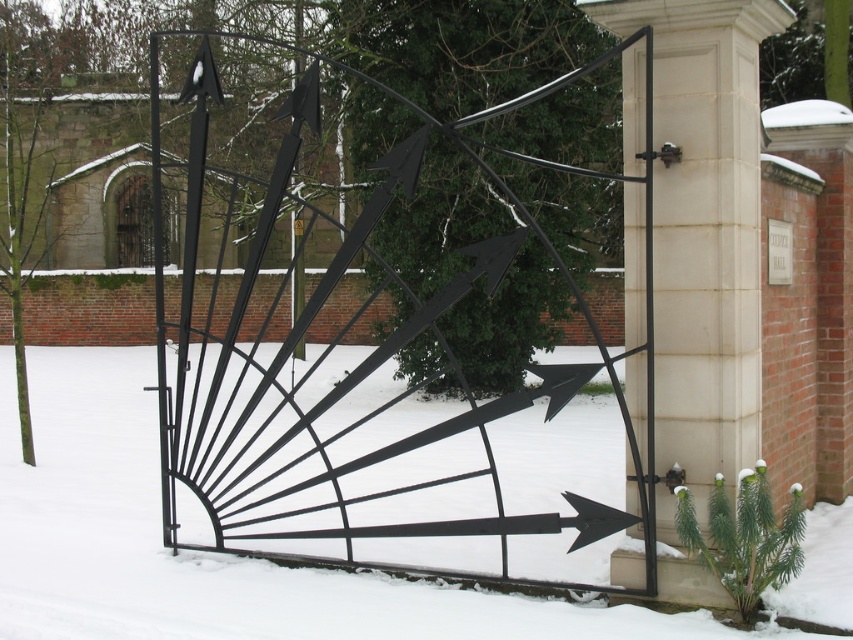
You are standing in front of the black metal gate with a geometric design. You notice a specific point labeled as point (202,554). What is the object located at this coordinate?

The point (202,554) indicates white matte snow at center.

Please describe the location of the white matte snow at center in the image using coordinates. The coordinate system has the origin at the bottom left corner of the image, with x increasing to the right and y increasing upward. The image has a width of 1 unit and a height of 1 unit. Please provide the coordinates as a tuple of two decimal numbers rounded to three decimal places.

The white matte snow at center is located at coordinates approximately equal to the point given in the description, so the coordinates are approximately at point (202, 554).